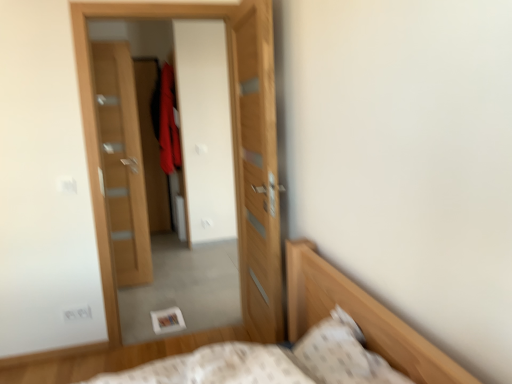
Question: Does wooden door at center, the 2th door when ordered from right to left, have a larger size compared to white textured pillow at lower right?

Choices:
 (A) yes
 (B) no

Answer: (A)

Question: Is wooden door at center, arranged as the 2th door when viewed from the front, located outside white textured pillow at lower right?

Choices:
 (A) no
 (B) yes

Answer: (B)

Question: Can white textured pillow at lower right be found inside wooden door at center, arranged as the 2th door when viewed from the left?

Choices:
 (A) no
 (B) yes

Answer: (A)

Question: Does wooden door at center, arranged as the 2th door when viewed from the left, have a greater width compared to white textured pillow at lower right?

Choices:
 (A) yes
 (B) no

Answer: (B)

Question: Can you confirm if wooden door at center, arranged as the 2th door when viewed from the left, is positioned to the left of white textured pillow at lower right?

Choices:
 (A) no
 (B) yes

Answer: (B)

Question: Is wooden door at center, arranged as the 2th door when viewed from the left, looking in the opposite direction of white textured pillow at lower right?

Choices:
 (A) yes
 (B) no

Answer: (B)

Question: Does wooden door at center, acting as the third door starting from the left, have a larger size compared to wooden door at center, the 2th door when ordered from right to left?

Choices:
 (A) no
 (B) yes

Answer: (A)

Question: Can you confirm if wooden door at center, which appears as the 1th door when viewed from the right, is shorter than wooden door at center, which ranks as the second door in back-to-front order?

Choices:
 (A) no
 (B) yes

Answer: (B)

Question: Is wooden door at center, the first door in the front-to-back sequence, at the right side of wooden door at center, arranged as the 2th door when viewed from the left?

Choices:
 (A) no
 (B) yes

Answer: (B)

Question: Does wooden door at center, acting as the third door starting from the left, contain wooden door at center, arranged as the 2th door when viewed from the left?

Choices:
 (A) no
 (B) yes

Answer: (A)

Question: Can you confirm if wooden door at center, which appears as the 1th door when viewed from the right, is thinner than wooden door at center, arranged as the 2th door when viewed from the left?

Choices:
 (A) yes
 (B) no

Answer: (A)

Question: Can you confirm if wooden door at center, the first door in the front-to-back sequence, is wider than wooden door at center, the 2th door when ordered from right to left?

Choices:
 (A) yes
 (B) no

Answer: (B)

Question: Considering the relative sizes of wooden door at left, the third door in the front-to-back sequence, and velvet red robe at center in the image provided, is wooden door at left, the third door in the front-to-back sequence, bigger than velvet red robe at center?

Choices:
 (A) no
 (B) yes

Answer: (A)